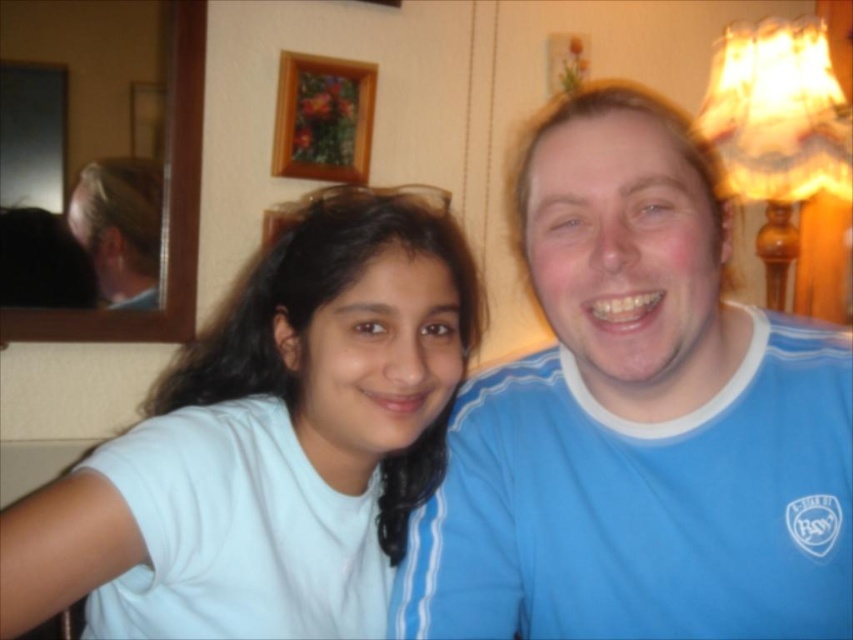
You are trying to decide which object takes up more horizontal space in the image. Which one is wider between the blue cotton shirt at right and the blonde hair at left?

The blue cotton shirt at right is wider than the blonde hair at left according to the description.